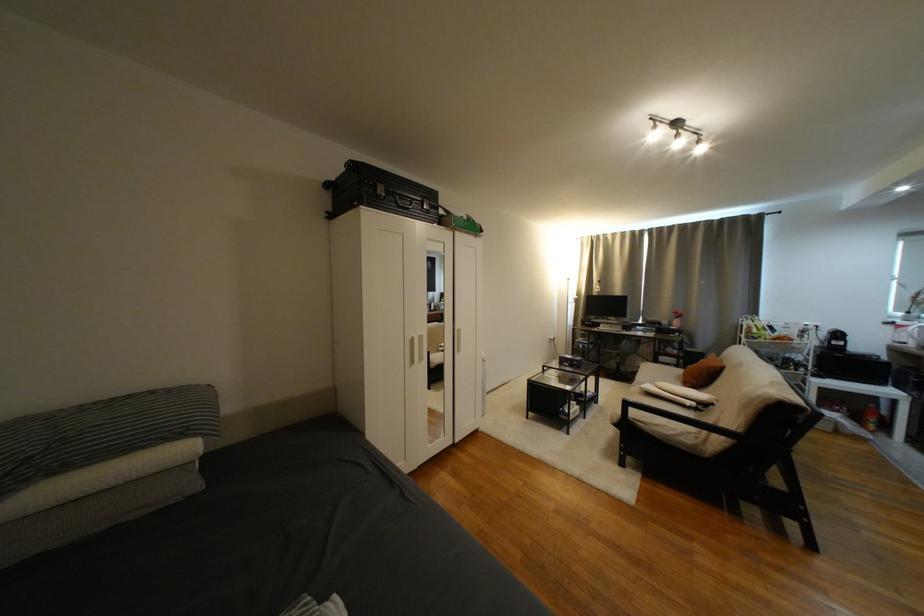
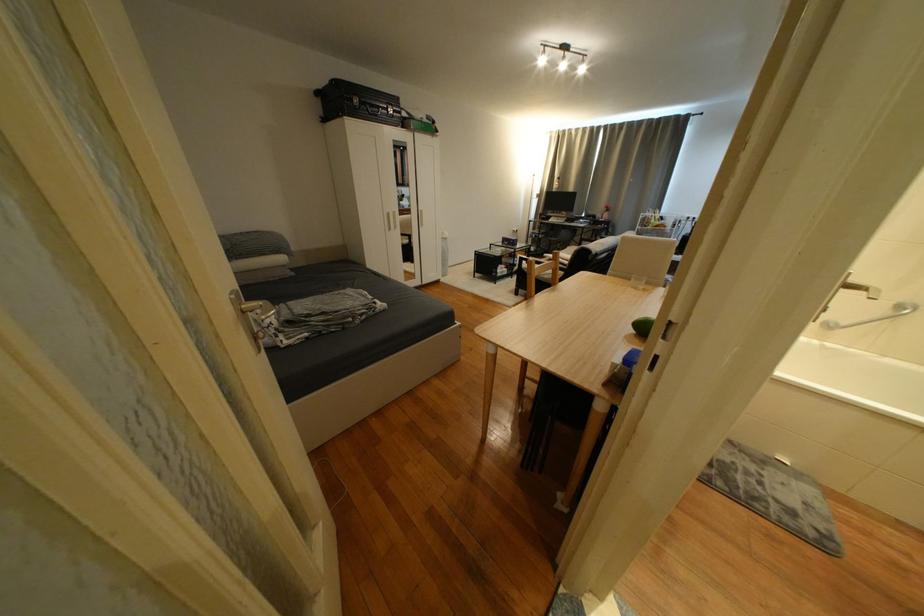
Which direction would the cameraman need to move to produce the second image?

The movement direction of the cameraman is right, backward.